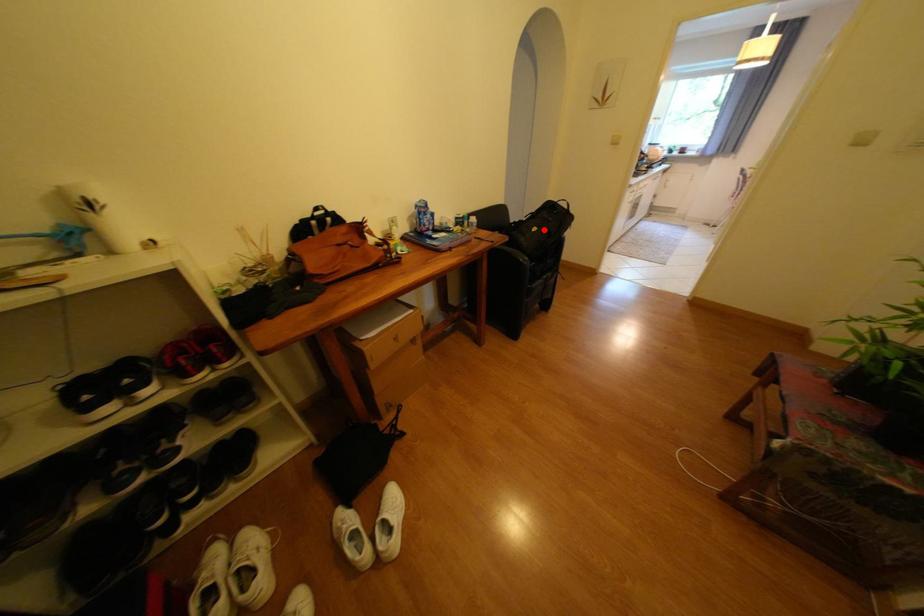
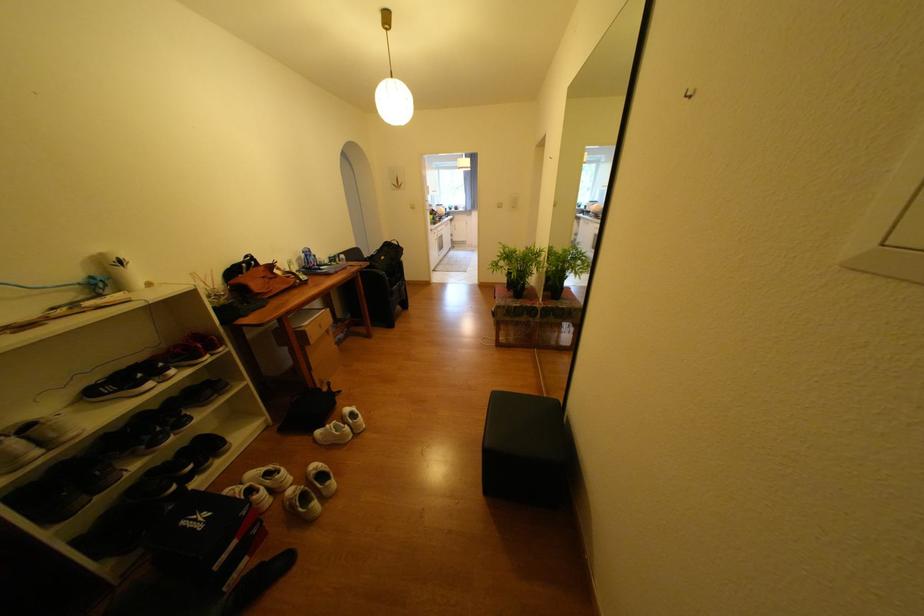
The point at the highlighted location is marked in the first image. Where is the corresponding point in the second image?

(392, 257)